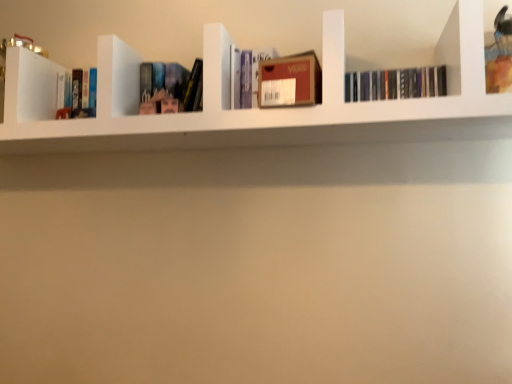
Question: Is black matte books at upper right, the 5th book in the left-to-right sequence, completely or partially outside of matte plastic book at center, which ranks as the 4th book in right-to-left order?

Choices:
 (A) no
 (B) yes

Answer: (B)

Question: From the image's perspective, is black matte books at upper right, which ranks as the first book in right-to-left order, over matte plastic book at center, the 2th book positioned from the left?

Choices:
 (A) no
 (B) yes

Answer: (B)

Question: Is black matte books at upper right, the 5th book in the left-to-right sequence, to the left of matte plastic book at center, the 2th book positioned from the left, from the viewer's perspective?

Choices:
 (A) yes
 (B) no

Answer: (B)

Question: From the image's perspective, would you say black matte books at upper right, the 5th book in the left-to-right sequence, is shown under matte plastic book at center, the 2th book positioned from the left?

Choices:
 (A) yes
 (B) no

Answer: (B)

Question: Can you confirm if black matte books at upper right, which ranks as the first book in right-to-left order, is positioned to the right of matte plastic book at center, the 2th book positioned from the left?

Choices:
 (A) yes
 (B) no

Answer: (A)

Question: Is point (88, 117) closer or farther from the camera than point (366, 72)?

Choices:
 (A) farther
 (B) closer

Answer: (A)

Question: From a real-world perspective, is hardcover book at left, the 5th book when ordered from right to left, positioned above or below black matte books at upper right, which ranks as the first book in right-to-left order?

Choices:
 (A) below
 (B) above

Answer: (B)

Question: Relative to black matte books at upper right, the 5th book in the left-to-right sequence, is hardcover book at left, which is the 1th book from left to right, in front or behind?

Choices:
 (A) behind
 (B) front

Answer: (A)

Question: In terms of size, does hardcover book at left, which is the 1th book from left to right, appear bigger or smaller than black matte books at upper right, which ranks as the first book in right-to-left order?

Choices:
 (A) small
 (B) big

Answer: (B)

Question: Is black matte books at upper right, which ranks as the first book in right-to-left order, spatially inside matte cardboard box at center, the third book when ordered from left to right, or outside of it?

Choices:
 (A) inside
 (B) outside

Answer: (B)

Question: Is black matte books at upper right, which ranks as the first book in right-to-left order, in front of or behind matte cardboard box at center, acting as the 3th book starting from the right, in the image?

Choices:
 (A) behind
 (B) front

Answer: (B)

Question: Is black matte books at upper right, the 5th book in the left-to-right sequence, bigger or smaller than matte cardboard box at center, acting as the 3th book starting from the right?

Choices:
 (A) big
 (B) small

Answer: (B)

Question: Visually, is black matte books at upper right, the 5th book in the left-to-right sequence, positioned to the left or to the right of matte cardboard box at center, acting as the 3th book starting from the right?

Choices:
 (A) left
 (B) right

Answer: (B)

Question: In the image, is black matte books at upper right, which ranks as the first book in right-to-left order, on the left side or the right side of hardcover book at left, which is the 1th book from left to right?

Choices:
 (A) right
 (B) left

Answer: (A)

Question: From the image's perspective, is black matte books at upper right, which ranks as the first book in right-to-left order, located above or below hardcover book at left, the 5th book when ordered from right to left?

Choices:
 (A) below
 (B) above

Answer: (A)